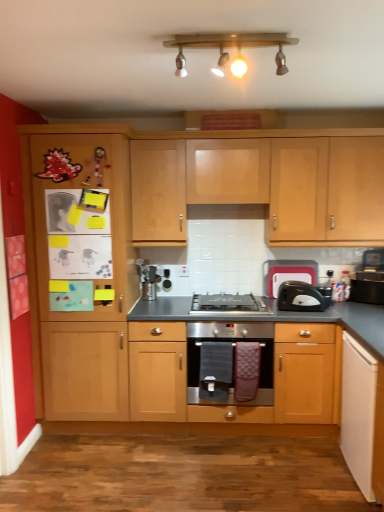
Identify the location of vacant area on top of wooden ceiling lights at upper center (from a real-world perspective). The width and height of the screenshot is (384, 512). (235, 34).